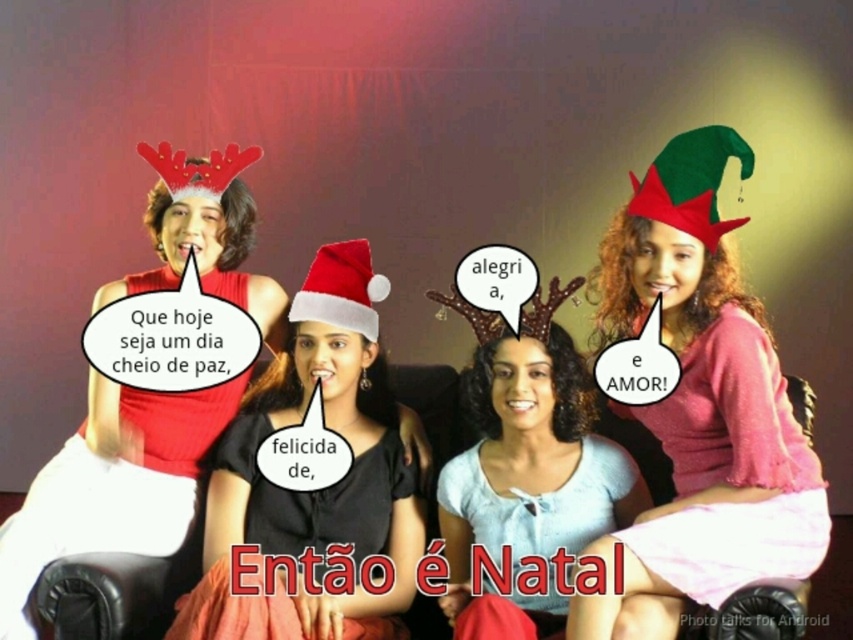
What is the position of the point (701, 404) in relation to the pink matte sweater at upper right?

The point (701, 404) is on the pink matte sweater at upper right.

You are an interior designer arranging a Christmas display. You have a pink matte sweater at upper right and a red velvet santa hat at center. Which item should you place closer to the edge of the shelf to ensure stability?

The pink matte sweater at upper right should be placed closer to the edge of the shelf because it might be wider than the red velvet santa hat at center, reducing the risk of it tipping over.

You are organizing a Christmas photo shoot and need to ensure that the matte red dress at center and the red velvet santa hat at center fit within a rectangular frame. Given that the frame can only accommodate objects up to the width of the wider object, which object determines the minimum required frame width?

The matte red dress at center has a larger width than the red velvet santa hat at center, so the frame must be at least as wide as the matte red dress at center to accommodate both items.